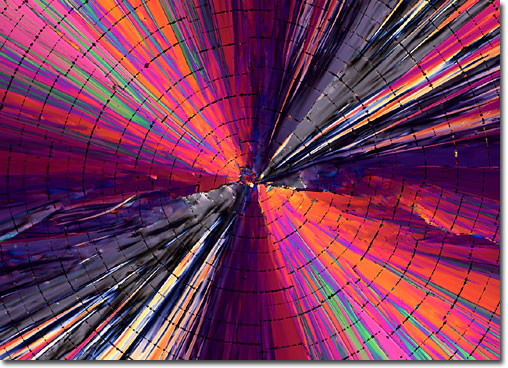
At what (x,y) coordinates should I click in order to perform the action: click on painting on canvas. Please return your answer as a coordinate pair (x, y). Looking at the image, I should click on (341, 307).